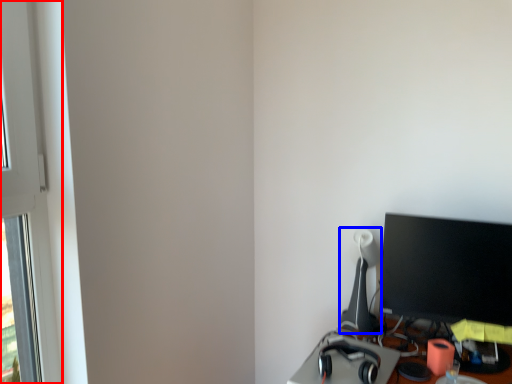
Question: Which of the following is the closest to the observer, window frame (highlighted by a red box) or table lamp (highlighted by a blue box)?

Choices:
 (A) window frame
 (B) table lamp

Answer: (A)